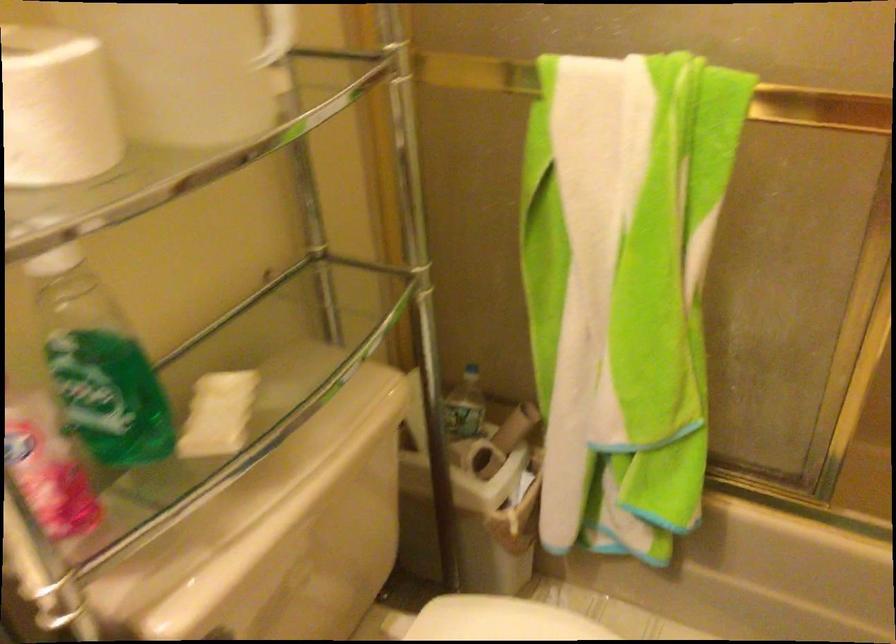
What are the coordinates of `pink spray bottle` in the screenshot? It's located at (80, 430).